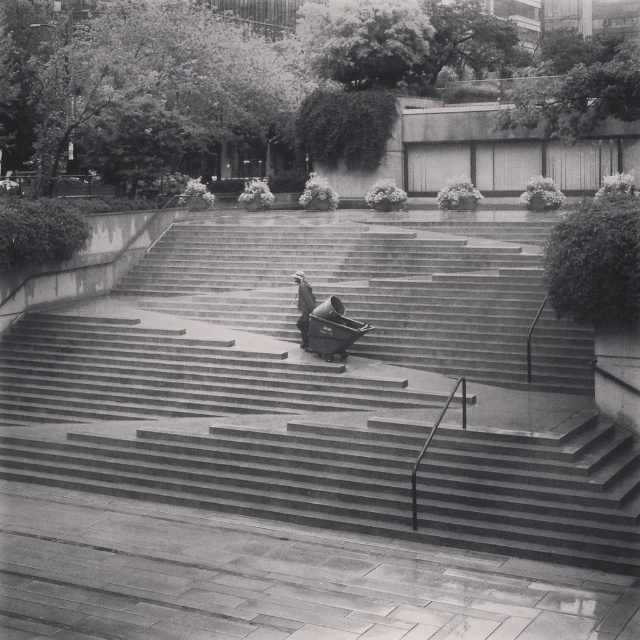
Is concrete stairs at center closer to camera compared to dark gray fabric coat at center?

That is True.

Identify the location of concrete stairs at center. (328, 392).

Identify the location of concrete stairs at center. (328, 392).